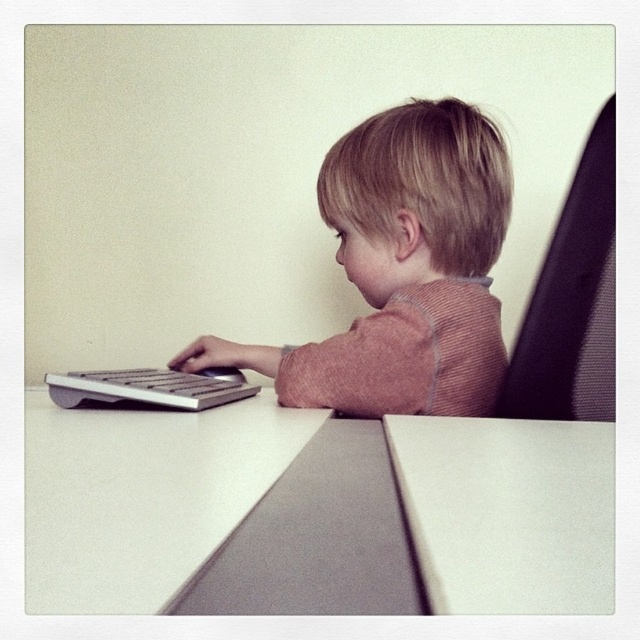
You are an interior designer planning to place a new desk lamp in the scene. The lamp requires a space of 0.5 units in width. Can the light brown corduroy toddler at center be positioned to accommodate the lamp without overlapping?

The light brown corduroy toddler at center is located at point (403, 269). Since the toddler occupies a specific coordinate, there might be sufficient space around them to place the lamp as long as the 0.5 units width does not overlap. However, without exact spatial dimensions, it is recommended to ensure the lamp is placed at a safe distance from the toddler.

You are a photographer setting up a shot of the light brown corduroy toddler at center and the white plastic keyboard at lower left. You want to ensure both are in focus. Since the toddler is closer to you than the keyboard, which should you adjust to include both in the frame?

The light brown corduroy toddler at center is closer to you than the white plastic keyboard at lower left. To get both in focus, adjust the camera to a wider aperture or increase the distance between the toddler and the keyboard.

You are organizing a classroom and need to place two white matte tables. The scene shows a white matte table at lower left and a white matte table at lower center. According to the image, which table is positioned higher up?

The white matte table at lower left is positioned higher up because it is above the white matte table at lower center.